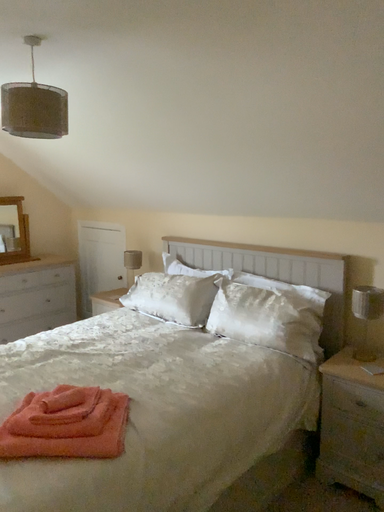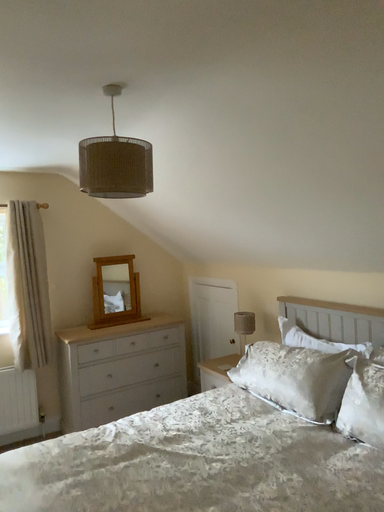
Question: How did the camera likely rotate when shooting the video?

Choices:
 (A) rotated right
 (B) rotated left

Answer: (B)